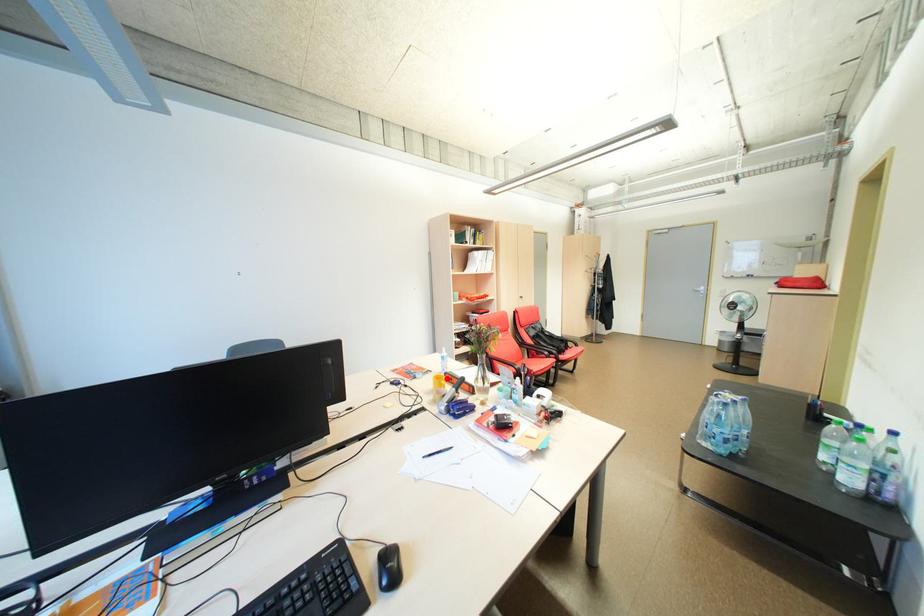
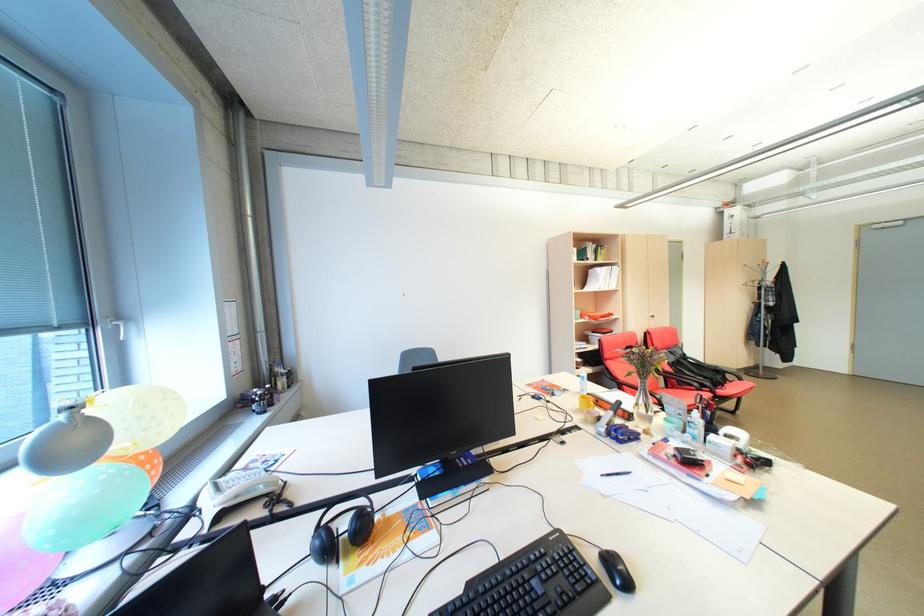
Find the pixel in the second image that matches the highlighted location in the first image.

(592, 399)